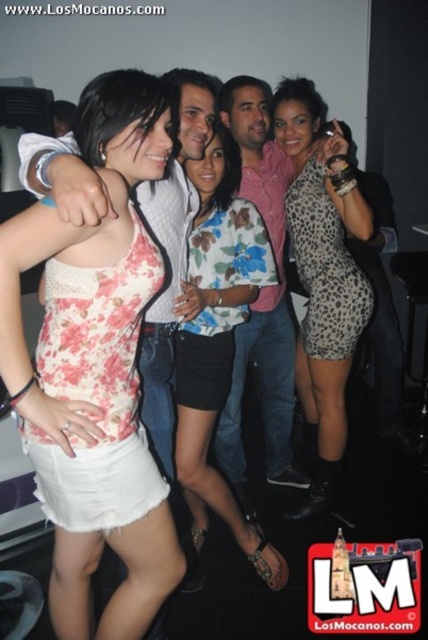
How distant is floral fabric dress at center from pink cotton shirt at center?

The distance of floral fabric dress at center from pink cotton shirt at center is 17.16 inches.

Who is higher up, floral fabric dress at center or pink cotton shirt at center?

pink cotton shirt at center is above.

Identify the location of floral fabric dress at center. Image resolution: width=428 pixels, height=640 pixels. (217, 340).

Does floral fabric dress at center have a lesser width compared to leopard print dress at center?

No, floral fabric dress at center is not thinner than leopard print dress at center.

Is floral fabric dress at center wider than leopard print dress at center?

Correct, the width of floral fabric dress at center exceeds that of leopard print dress at center.

Does point (222, 333) come farther from viewer compared to point (308, 116)?

No, it is in front of (308, 116).

Locate an element on the screen. This screenshot has height=640, width=428. floral fabric dress at center is located at coordinates (217, 340).

Can you confirm if floral fabric tank top at center is shorter than leopard print dress at center?

Yes.

Is floral fabric tank top at center to the right of leopard print dress at center from the viewer's perspective?

No, floral fabric tank top at center is not to the right of leopard print dress at center.

Identify the location of floral fabric tank top at center. (98, 353).